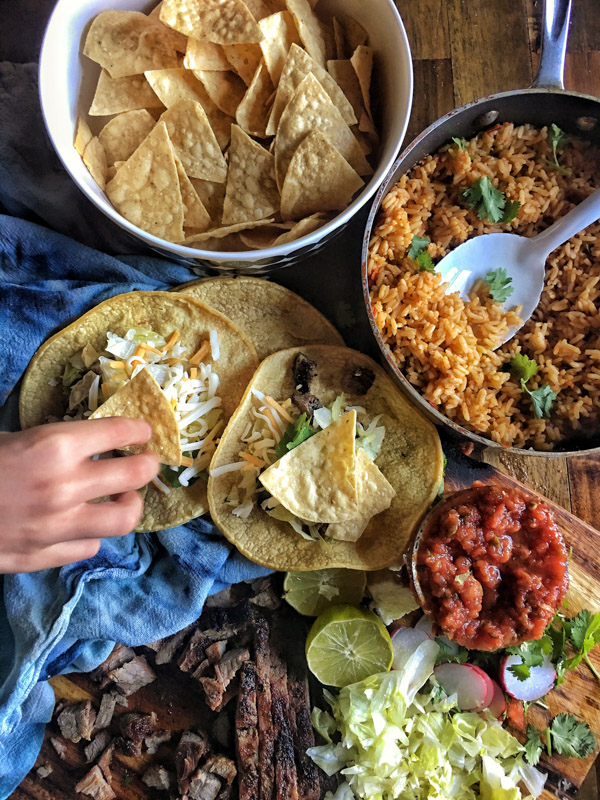
Image resolution: width=600 pixels, height=800 pixels. I want to click on bowl, so click(x=56, y=110).